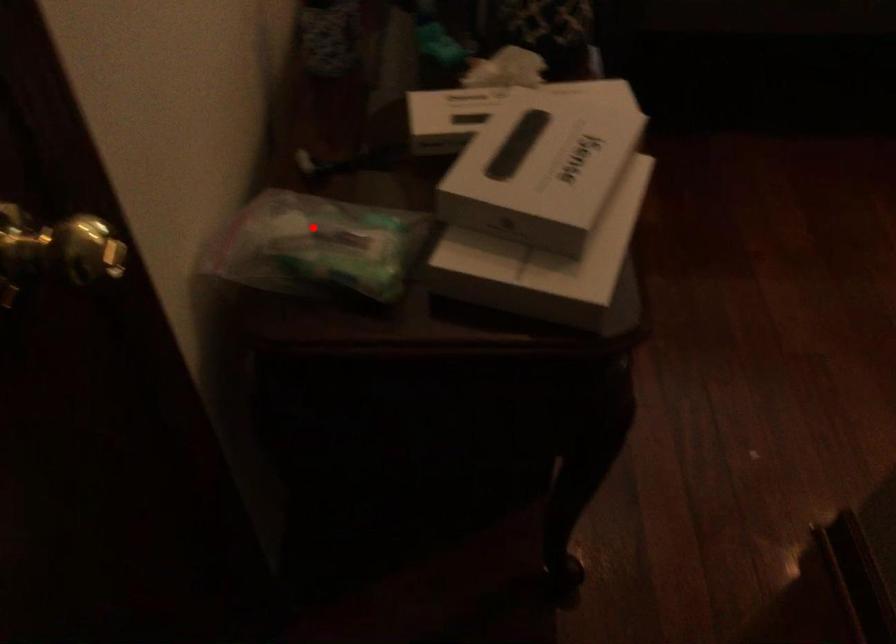
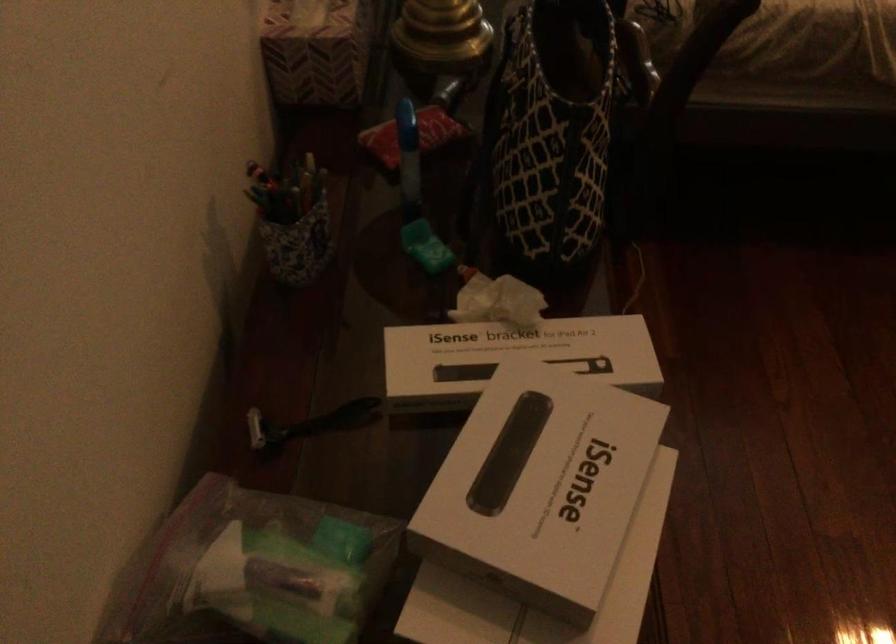
Find the pixel in the second image that matches the highlighted location in the first image.

(252, 571)